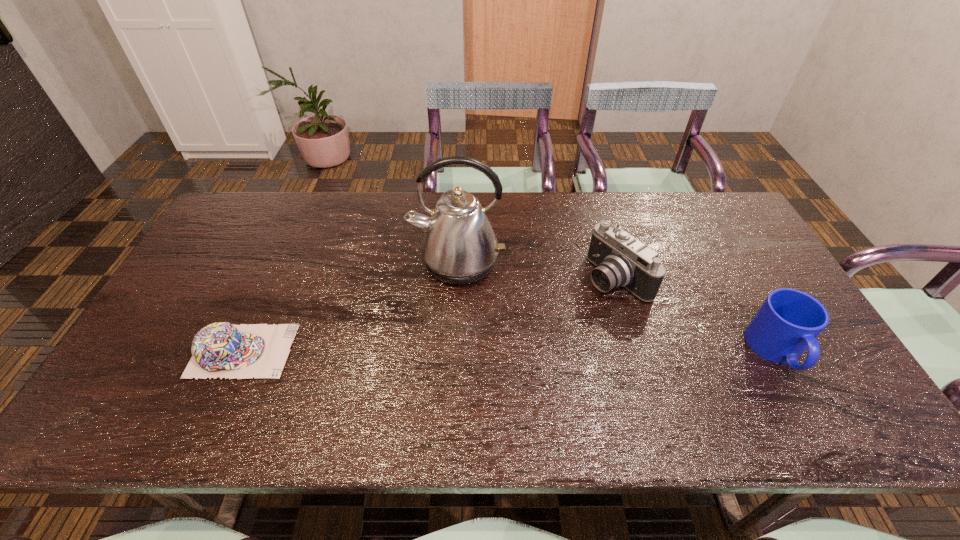
You are a GUI agent. You are given a task and a screenshot of the screen. Output one action in this format:
    pyautogui.click(x=<x>, y=<y>)
    Task: Click on the vacant space that's between the third object from left to right and the second object from left to right
    
    Given the screenshot: What is the action you would take?
    pyautogui.click(x=537, y=270)

Locate an element on the screen. This screenshot has width=960, height=540. free space between the cap and the mug is located at coordinates (510, 351).

You are a GUI agent. You are given a task and a screenshot of the screen. Output one action in this format:
    pyautogui.click(x=<x>, y=<y>)
    Task: Click on the free space between the cap and the rightmost object
    
    Given the screenshot: What is the action you would take?
    pyautogui.click(x=510, y=351)

Point out which object is positioned as the nearest to the third object from right to left. Please provide its 2D coordinates. Your answer should be formatted as a tuple, i.e. [(x, y)], where the tuple contains the x and y coordinates of a point satisfying the conditions above.

[(621, 260)]

The image size is (960, 540). I want to click on object identified as the second closest to the second object from left to right, so click(x=221, y=349).